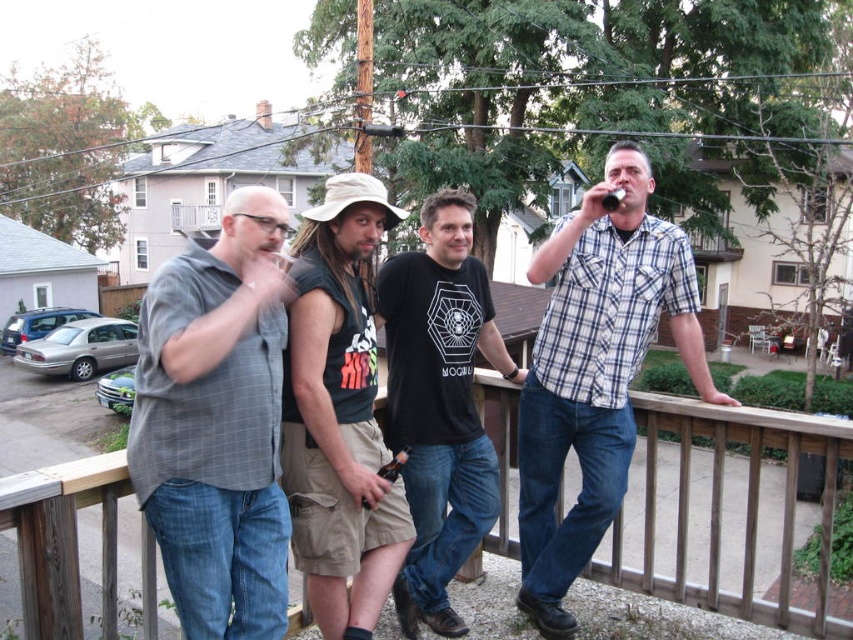
Question: Which object is closer to the camera taking this photo?

Choices:
 (A) plaid cotton shirt at right
 (B) khaki cotton shorts at center
 (C) gray checkered shirt at left
 (D) black cotton t-shirt at center

Answer: (C)

Question: Can you confirm if plaid cotton shirt at right is smaller than khaki cotton shorts at center?

Choices:
 (A) no
 (B) yes

Answer: (A)

Question: Where is plaid cotton shirt at right located in relation to khaki cotton shorts at center in the image?

Choices:
 (A) left
 (B) right

Answer: (B)

Question: Among these objects, which one is nearest to the camera?

Choices:
 (A) khaki cotton shorts at center
 (B) plaid cotton shirt at right
 (C) gray checkered shirt at left
 (D) black cotton t-shirt at center

Answer: (C)

Question: Which object is closer to the camera taking this photo?

Choices:
 (A) khaki cotton shorts at center
 (B) plaid cotton shirt at right
 (C) gray checkered shirt at left

Answer: (C)

Question: Is gray checkered shirt at left to the left of black cotton t-shirt at center from the viewer's perspective?

Choices:
 (A) no
 (B) yes

Answer: (B)